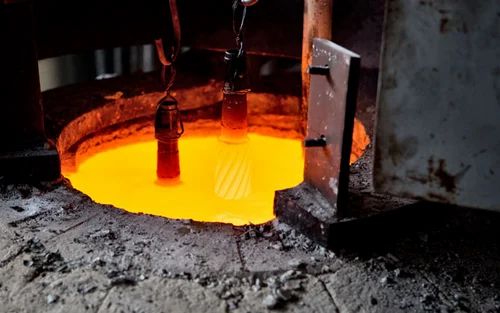
I want to click on floor, so click(379, 266).